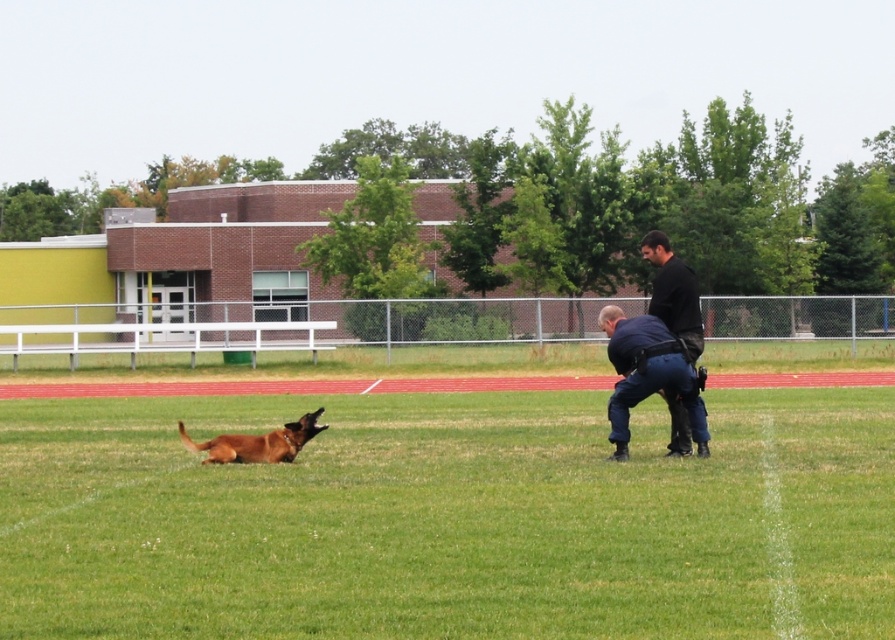
Based on the scene description, what is the 2D coordinate of the green grass at center?

The 2D coordinate of the green grass at center is at point (449, 518).

You are a photographer setting up a tripod to capture a closeup of the brown matte dog at lower left and the brown furry dog at lower left. Since you want to ensure both dogs are in focus, you need to know which one is taller. Which dog is taller?

The brown matte dog at lower left is taller than the brown furry dog at lower left according to the description.

You are a photographer setting up a shot of the green grass at center and the brown furry dog at lower left. Which object is closer to the camera?

The brown furry dog at lower left is closer to the camera because the green grass at center is positioned under it.